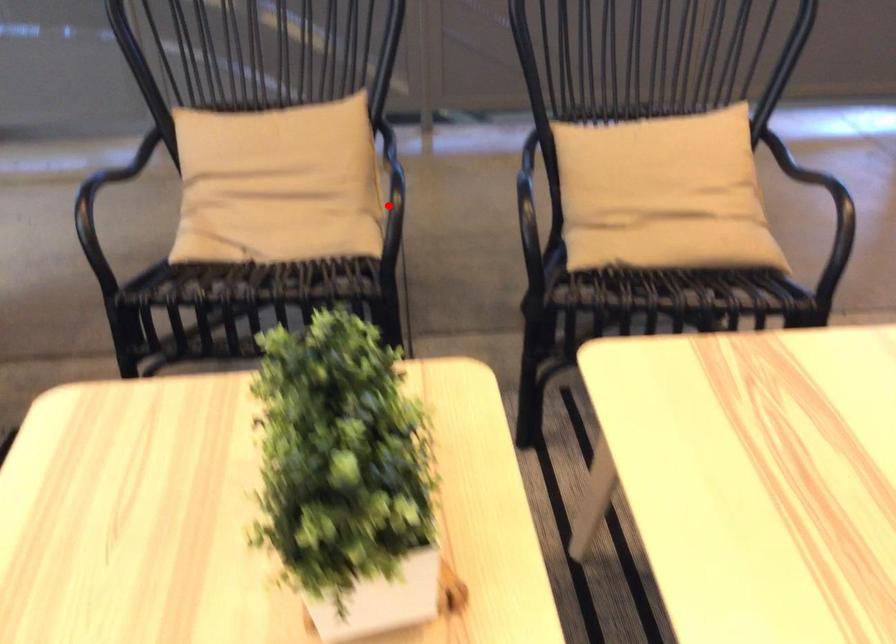
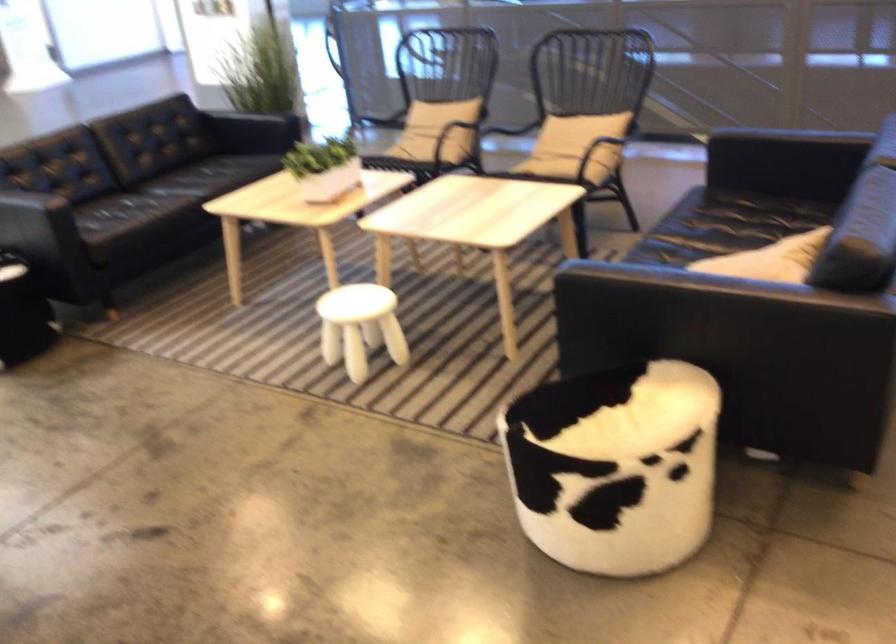
Question: I am providing you with two images of the same scene from different viewpoints. In image1, a red point is highlighted. Considering the same 3D point in image2, which of the following is correct?

Choices:
 (A) It is closer
 (B) It is farther

Answer: (B)